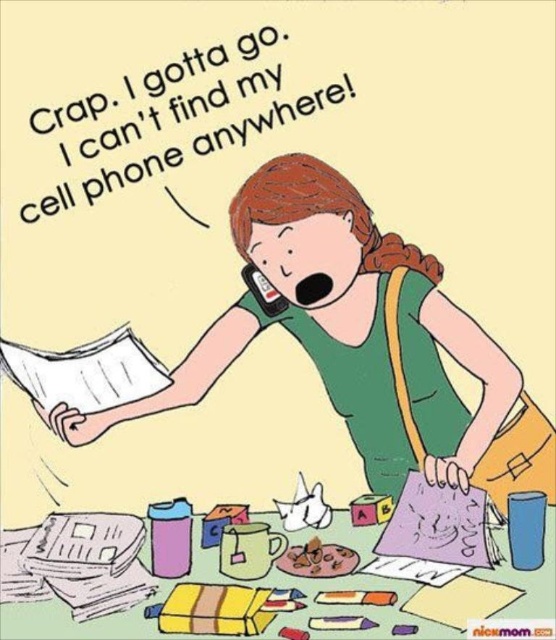
You are a detective examining the scene. You notice the green fabric shirt at center and the matte black phone at mouth. Which object is positioned closer to you?

The green fabric shirt at center is closer to the viewer than the matte black phone at mouth.